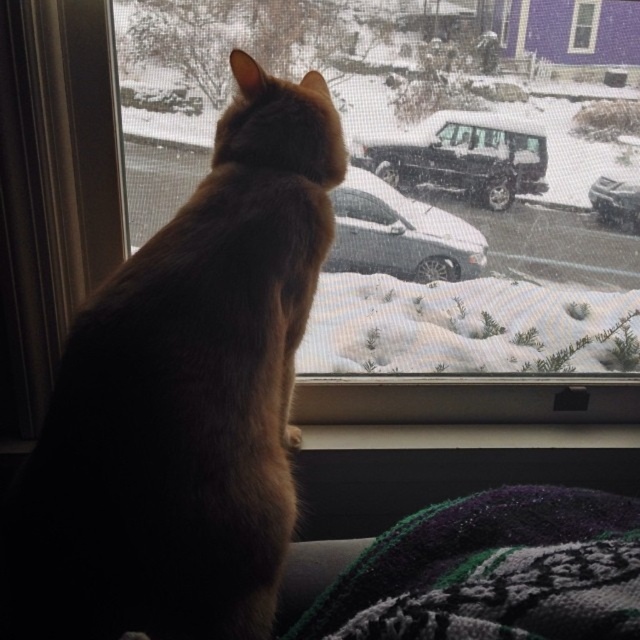
Does transparent glass window at center have a lesser height compared to brown furry cat at center?

Indeed, transparent glass window at center has a lesser height compared to brown furry cat at center.

Is transparent glass window at center below brown furry cat at center?

No.

Where is `transparent glass window at center`? This screenshot has width=640, height=640. transparent glass window at center is located at coordinates (420, 170).

Find the location of a particular element. The image size is (640, 640). transparent glass window at center is located at coordinates (420, 170).

Who is positioned more to the right, knitted woolen blanket at lower right or clear glass window at upper center?

clear glass window at upper center

Can you confirm if knitted woolen blanket at lower right is positioned to the right of clear glass window at upper center?

Incorrect, knitted woolen blanket at lower right is not on the right side of clear glass window at upper center.

This screenshot has height=640, width=640. Find the location of `knitted woolen blanket at lower right`. knitted woolen blanket at lower right is located at coordinates (492, 572).

Between sleek silver sedan at center and clear glass window at upper center, which one is positioned lower?

sleek silver sedan at center

Does point (403, 196) come in front of point (573, 13)?

No, (403, 196) is behind (573, 13).

You are a GUI agent. You are given a task and a screenshot of the screen. Output one action in this format:
    pyautogui.click(x=<x>, y=<y>)
    Task: Click on the sleek silver sedan at center
    The image size is (640, 640).
    Given the screenshot: What is the action you would take?
    pyautogui.click(x=400, y=234)